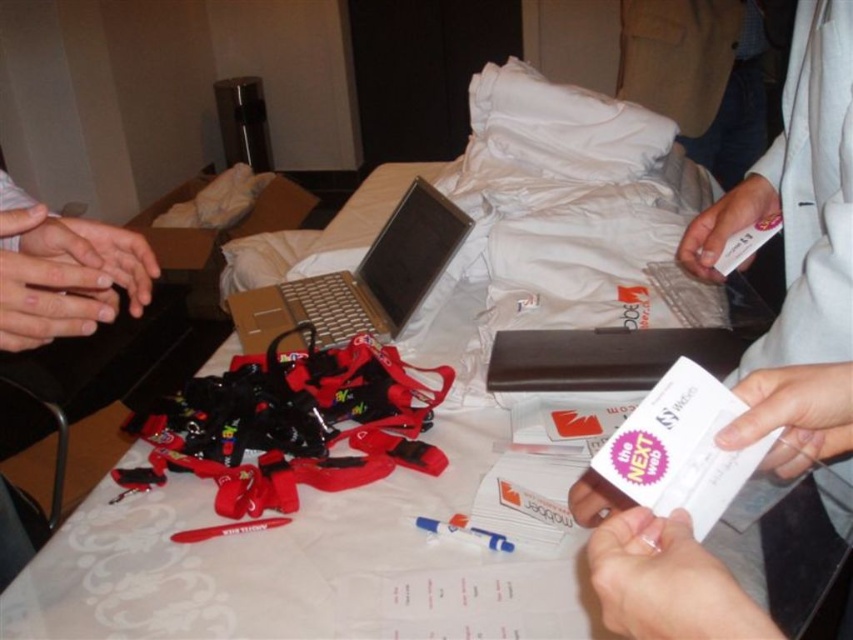
Does silver metallic laptop at center appear over brown leather laptop at center?

Yes.

Is silver metallic laptop at center wider than brown leather laptop at center?

No.

Identify the location of silver metallic laptop at center. (358, 282).

The image size is (853, 640). I want to click on silver metallic laptop at center, so click(x=358, y=282).

The image size is (853, 640). I want to click on white paper at center, so click(798, 257).

Image resolution: width=853 pixels, height=640 pixels. Identify the location of white paper at center. (798, 257).

What do you see at coordinates (622, 349) in the screenshot? I see `brown leather laptop at center` at bounding box center [622, 349].

Does brown leather laptop at center have a greater height compared to white paper table at center?

Incorrect, brown leather laptop at center's height is not larger of white paper table at center's.

In order to click on brown leather laptop at center in this screenshot , I will do `click(622, 349)`.

The image size is (853, 640). What are the coordinates of `brown leather laptop at center` in the screenshot? It's located at (622, 349).